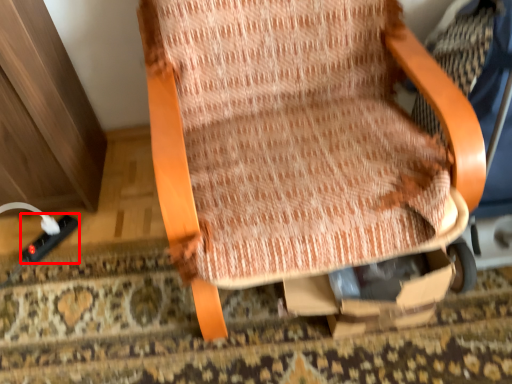
Question: Observing the image, what is the correct spatial positioning of plug (annotated by the red box) in reference to chair?

Choices:
 (A) right
 (B) left

Answer: (B)